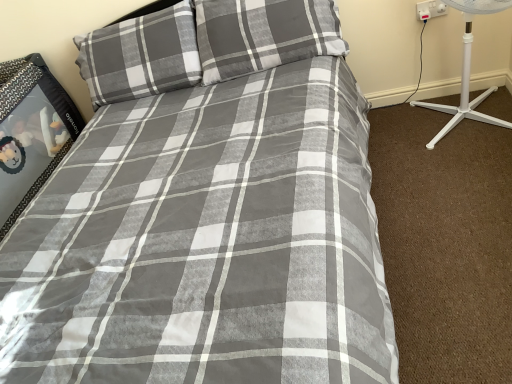
Question: Considering the relative sizes of white plastic socket at upper right and gray cotton pillow at upper center, the 1th pillow viewed from the right, in the image provided, is white plastic socket at upper right wider than gray cotton pillow at upper center, the 1th pillow viewed from the right,?

Choices:
 (A) yes
 (B) no

Answer: (B)

Question: Is white plastic socket at upper right positioned with its back to gray cotton pillow at upper center, the 1th pillow viewed from the right?

Choices:
 (A) no
 (B) yes

Answer: (A)

Question: From the image's perspective, does white plastic socket at upper right appear higher than gray cotton pillow at upper center, arranged as the second pillow when viewed from the left?

Choices:
 (A) yes
 (B) no

Answer: (A)

Question: Does white plastic socket at upper right appear on the right side of gray cotton pillow at upper center, arranged as the second pillow when viewed from the left?

Choices:
 (A) no
 (B) yes

Answer: (B)

Question: Is white plastic socket at upper right thinner than gray cotton pillow at upper center, arranged as the second pillow when viewed from the left?

Choices:
 (A) no
 (B) yes

Answer: (B)

Question: Would you consider white plastic socket at upper right to be distant from gray cotton pillow at upper center, arranged as the second pillow when viewed from the left?

Choices:
 (A) yes
 (B) no

Answer: (B)

Question: From a real-world perspective, is gray plaid pillow at upper left, the second pillow when ordered from right to left, positioned under white plastic fan at right based on gravity?

Choices:
 (A) yes
 (B) no

Answer: (B)

Question: From the image's perspective, does gray plaid pillow at upper left, the first pillow in the left-to-right sequence, appear higher than white plastic fan at right?

Choices:
 (A) yes
 (B) no

Answer: (A)

Question: Is gray plaid pillow at upper left, the second pillow when ordered from right to left, at the right side of white plastic fan at right?

Choices:
 (A) no
 (B) yes

Answer: (A)

Question: From a real-world perspective, is gray plaid pillow at upper left, the second pillow when ordered from right to left, located higher than white plastic fan at right?

Choices:
 (A) no
 (B) yes

Answer: (B)

Question: Considering the relative positions of gray plaid pillow at upper left, the first pillow in the left-to-right sequence, and white plastic fan at right in the image provided, is gray plaid pillow at upper left, the first pillow in the left-to-right sequence, behind white plastic fan at right?

Choices:
 (A) yes
 (B) no

Answer: (A)

Question: From the image's perspective, is gray plaid pillow at upper left, the first pillow in the left-to-right sequence, below white plastic fan at right?

Choices:
 (A) yes
 (B) no

Answer: (B)

Question: Does gray plaid pillow at upper left, the second pillow when ordered from right to left, appear on the right side of gray cotton pillow at upper center, arranged as the second pillow when viewed from the left?

Choices:
 (A) yes
 (B) no

Answer: (B)